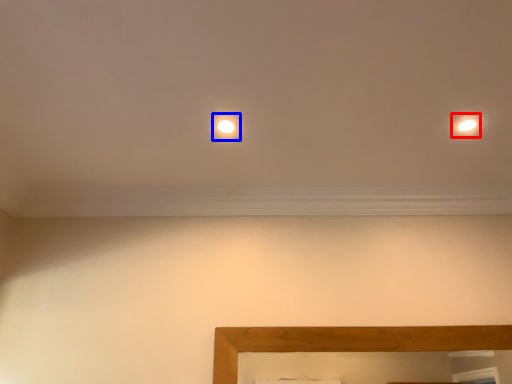
Question: Which object is further to the camera taking this photo, light (highlighted by a red box) or glow (highlighted by a blue box)?

Choices:
 (A) light
 (B) glow

Answer: (B)